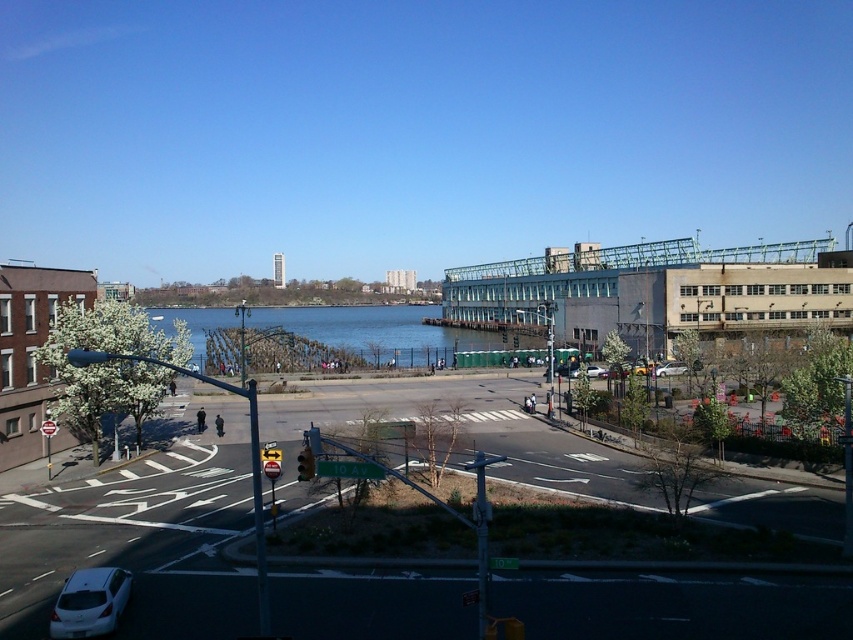
Question: Estimate the real-world distances between objects in this image. Which object is closer to the matte silver sedan at center?

Choices:
 (A) white matte car at lower left
 (B) clear blue water at center
 (C) metallic silver sedan at center

Answer: (C)

Question: Can you confirm if metallic traffic light at center is smaller than metallic silver sedan at center?

Choices:
 (A) yes
 (B) no

Answer: (B)

Question: Does silver metallic sedan at center-right have a larger size compared to metallic silver sedan at center?

Choices:
 (A) yes
 (B) no

Answer: (B)

Question: Among these points, which one is farthest from the camera?

Choices:
 (A) (109, 625)
 (B) (299, 458)

Answer: (B)

Question: Is silver metallic sedan at center-right above metallic silver sedan at center?

Choices:
 (A) yes
 (B) no

Answer: (B)

Question: Among these objects, which one is nearest to the camera?

Choices:
 (A) clear blue water at center
 (B) white matte car at lower left

Answer: (B)